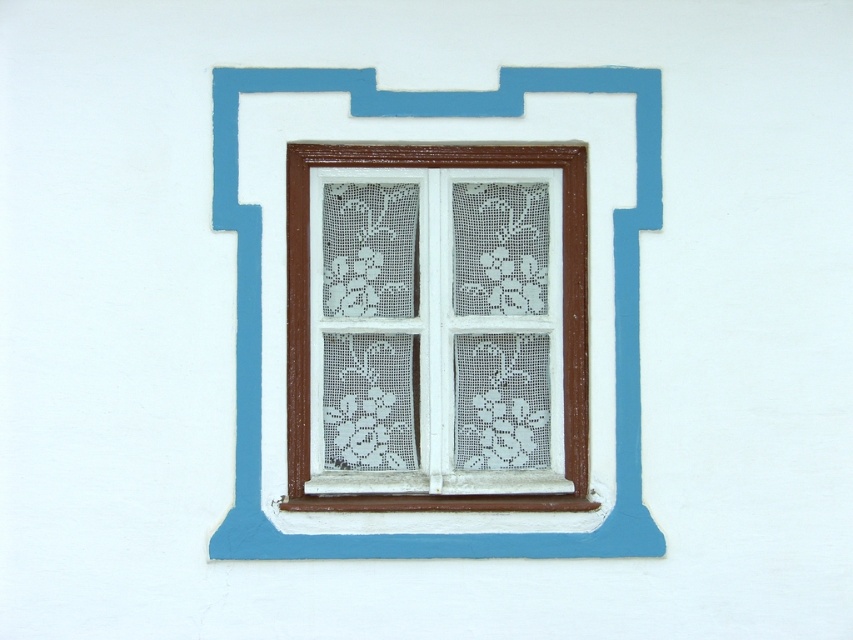
Can you confirm if white lace curtain at center is positioned to the left of brown wood window frame at center?

Indeed, white lace curtain at center is positioned on the left side of brown wood window frame at center.

Between white lace curtain at center and brown wood window frame at center, which one has more height?

With more height is brown wood window frame at center.

Does point (532, 193) lie behind point (503, 538)?

Yes, point (532, 193) is farther from viewer.

Identify the location of white lace curtain at center. point(436,326).